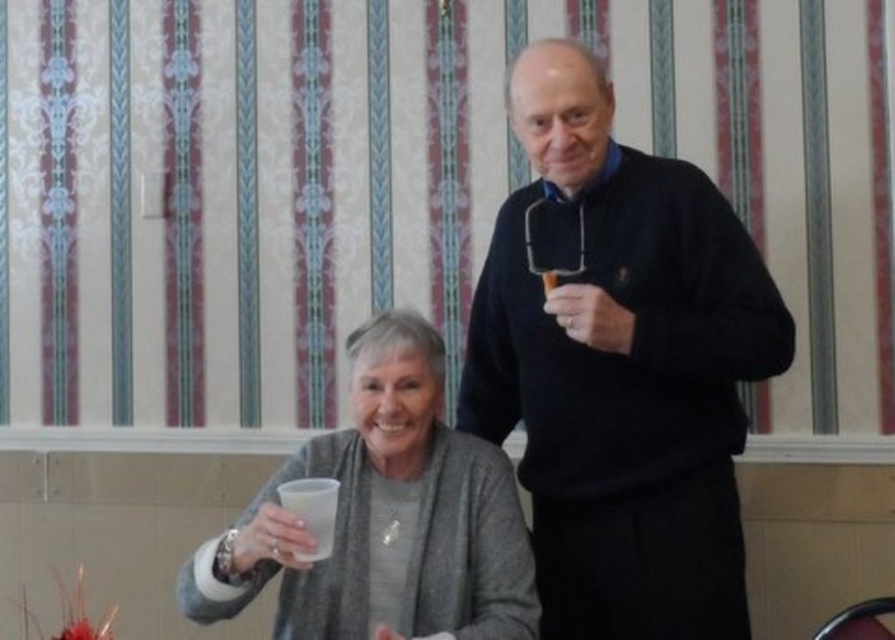
Question: Observing the image, what is the correct spatial positioning of black matte sweater at center in reference to translucent plastic cup at center?

Choices:
 (A) above
 (B) below

Answer: (A)

Question: Is black matte sweater at center smaller than translucent plastic cup at center?

Choices:
 (A) yes
 (B) no

Answer: (B)

Question: Where is black matte sweater at center located in relation to translucent plastic cup at center in the image?

Choices:
 (A) right
 (B) left

Answer: (A)

Question: Among these points, which one is farthest from the camera?

Choices:
 (A) (355, 426)
 (B) (638, 333)

Answer: (A)